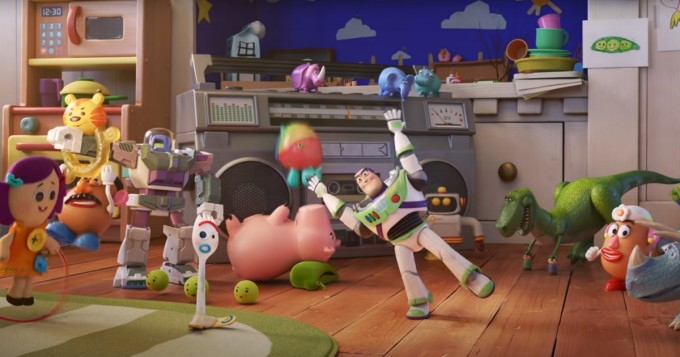
Find the location of a particular element. play kitchen is located at coordinates (102, 52).